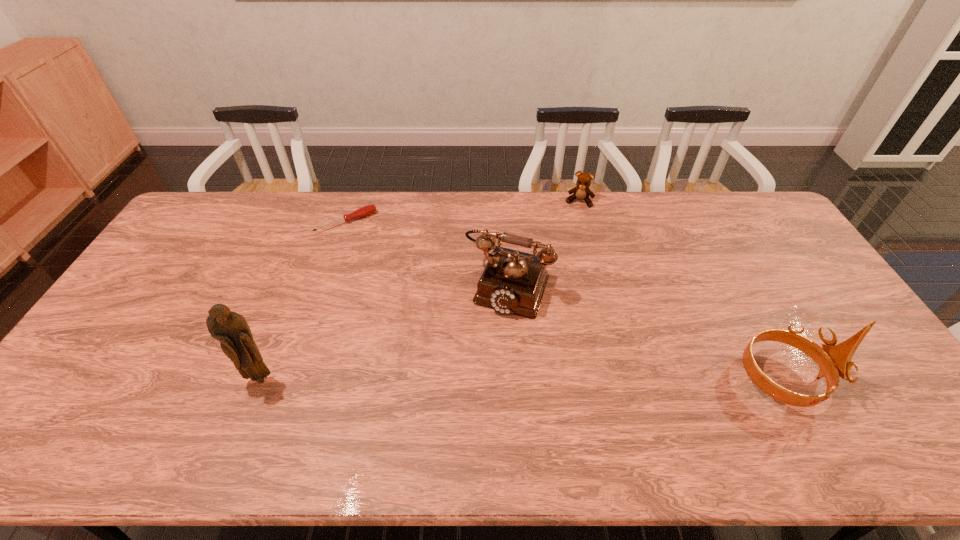
Locate an element on the screen. vacant spot on the desktop that is between the tallest object and the tiara and is positioned at the tip of the shortest object is located at coordinates (464, 379).

Find the location of a particular element. free space on the desktop that is between the tallest object and the rightmost object and is positioned on the dial of the third object from left to right is located at coordinates (469, 379).

Identify the location of free space on the desktop that is between the tallest object and the rightmost object and is positioned on the front-facing side of the fourth tallest object. (526, 379).